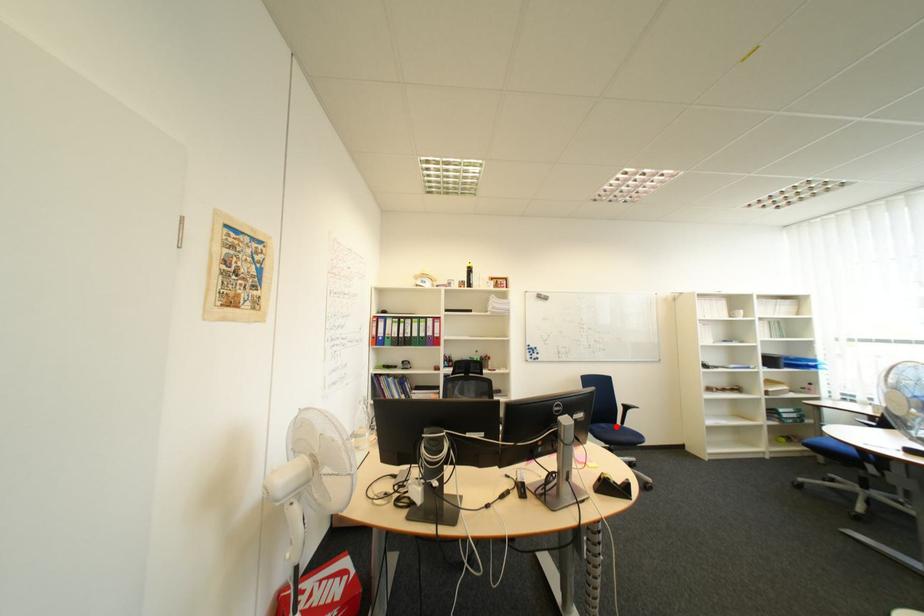
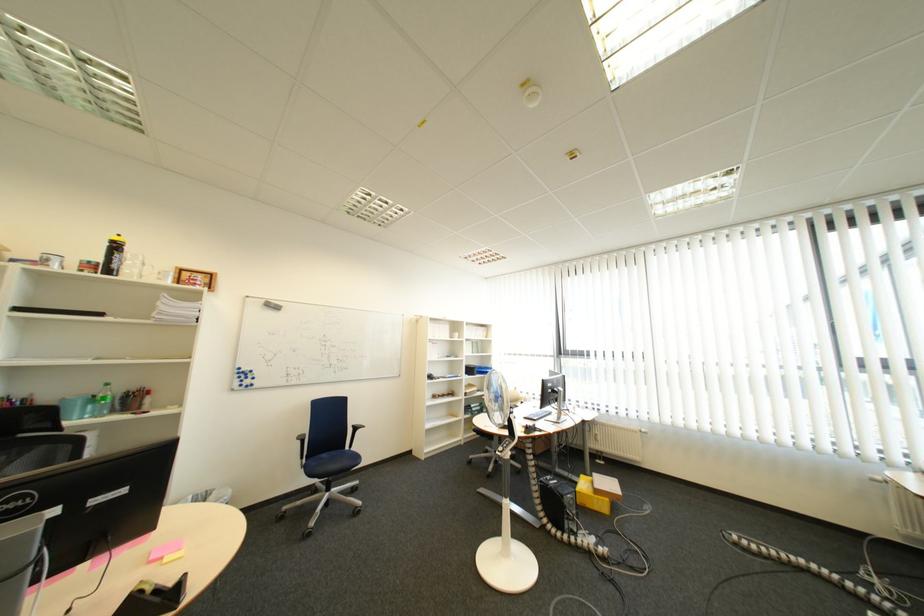
Question: I am providing you with two images of the same scene from different viewpoints. In image1, a red point is highlighted. Considering the same 3D point in image2, which of the following is correct?

Choices:
 (A) It is closer
 (B) It is farther

Answer: (A)